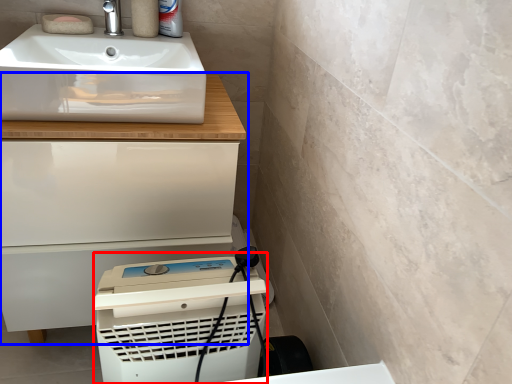
Question: Which point is closer to the camera, appliance (highlighted by a red box) or bathroom cabinet (highlighted by a blue box)?

Choices:
 (A) appliance
 (B) bathroom cabinet

Answer: (A)